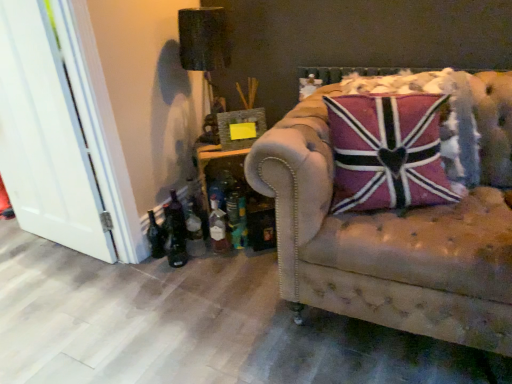
Question: Considering the positions of translucent glass bottle at lower left, acting as the 3th bottle starting from the left, and white wood door at left in the image, is translucent glass bottle at lower left, acting as the 3th bottle starting from the left, bigger or smaller than white wood door at left?

Choices:
 (A) small
 (B) big

Answer: (A)

Question: Looking at their shapes, would you say translucent glass bottle at lower left, acting as the 3th bottle starting from the left, is wider or thinner than white wood door at left?

Choices:
 (A) thin
 (B) wide

Answer: (B)

Question: Based on their relative distances, which object is nearer to the dark glass bottle at lower left, the 3th bottle when ordered from right to left?

Choices:
 (A) translucent glass bottle at lower left, the 1th bottle viewed from the right
 (B) leather tufted couch at right
 (C) translucent glass bottle at lower left, the 2th bottle in the left-to-right sequence
 (D) pink fabric pillow at center
 (E) wooden table at lower left

Answer: (C)

Question: Which is nearer to the translucent glass bottle at lower left, acting as the 3th bottle starting from the left?

Choices:
 (A) wooden table at lower left
 (B) black textured lampshade at upper left
 (C) dark glass bottle at lower left, the 3th bottle when ordered from right to left
 (D) green glass bottle at lower left
 (E) wooden picture frame at center

Answer: (A)